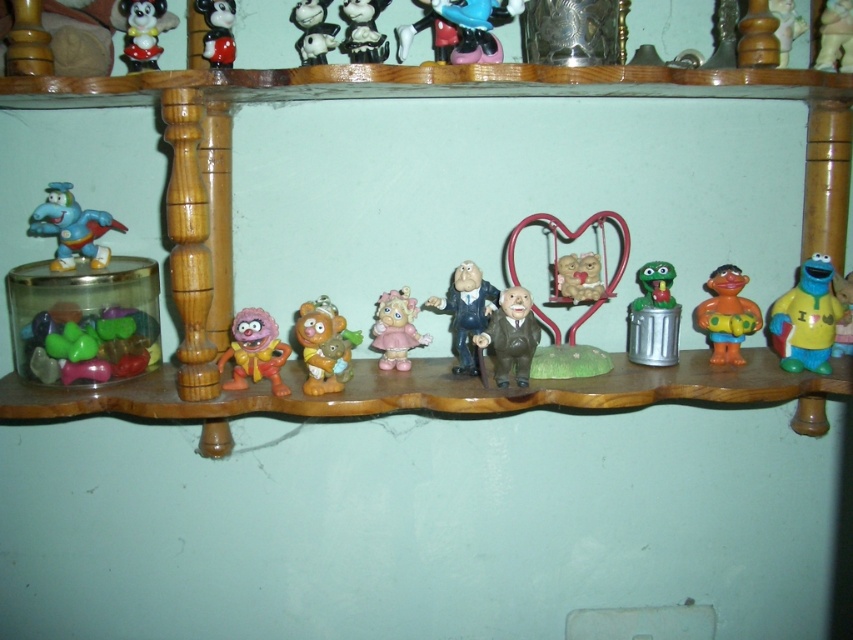
You are trying to place a new figurine on the wooden shelf. The shelf has a scalloped edge design and is supported by vertical wooden posts with decorative carvings at the top. You have a shiny silver figurine that you want to place on the shelf. Where exactly should you place it to match the existing arrangement? Please provide coordinates in the format of point coordinates like point (363, 29).

The shiny silver figurine should be placed at point (363, 29) as specified in the coordinates provided.

You are organizing the shelf and want to place a new toy between the shiny blue plastic dinosaur at left and the orange matte bear at center. Where should you place it?

Place the new toy between the shiny blue plastic dinosaur at left and the orange matte bear at center, to the right of the shiny blue plastic dinosaur at left and to the left of the orange matte bear at center since the shiny blue plastic dinosaur at left is on the left side of the orange matte bear at center.